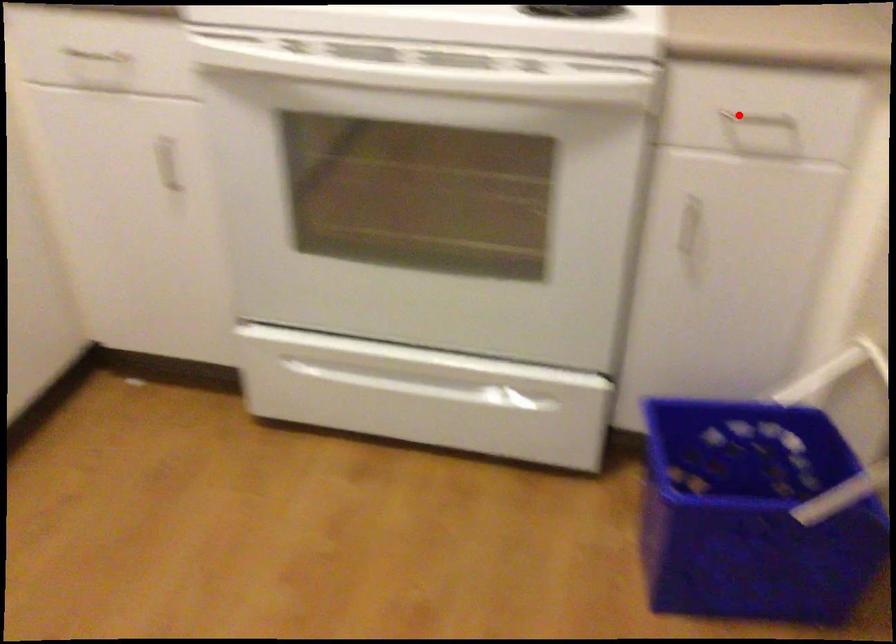
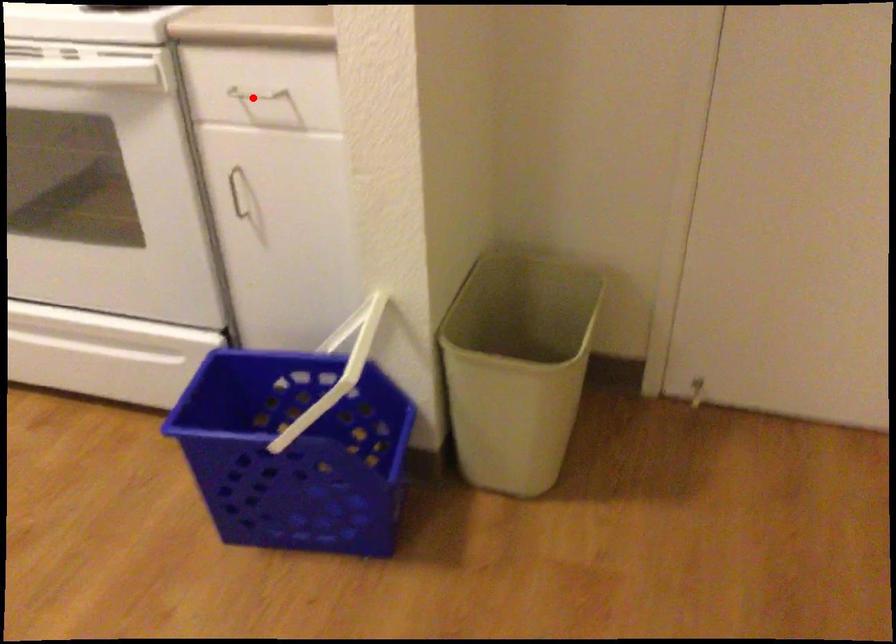
I am providing you with two images of the same scene from different viewpoints. A red point is marked on the first image and another point is marked on the second image. Are the points marked in image1 and image2 representing the same 3D position?

Yes